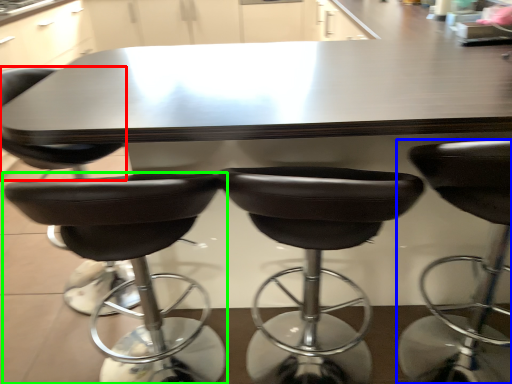
Question: Which object is positioned closest to chair (highlighted by a red box)? Select from chair (highlighted by a blue box) and chair (highlighted by a green box).

Choices:
 (A) chair
 (B) chair

Answer: (B)